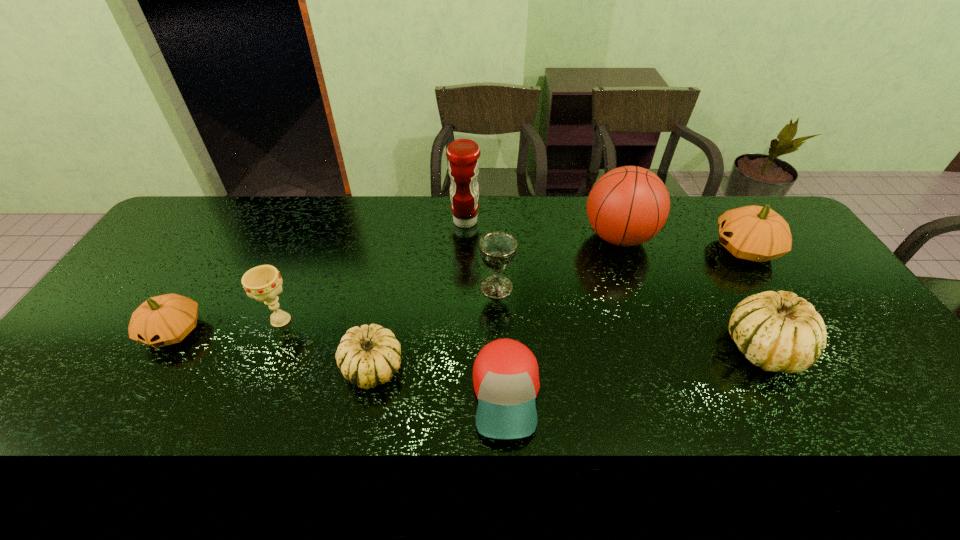
Where is `object that is at the right edge`? The image size is (960, 540). object that is at the right edge is located at coordinates (754, 233).

Where is `object present at the far right corner`? This screenshot has height=540, width=960. object present at the far right corner is located at coordinates (754, 233).

This screenshot has height=540, width=960. What are the coordinates of `vacant area at the far edge` in the screenshot? It's located at (505, 227).

Find the location of a particular element. The width and height of the screenshot is (960, 540). vacant space at the left edge of the desktop is located at coordinates (139, 284).

This screenshot has width=960, height=540. I want to click on vacant region at the right edge of the desktop, so click(x=821, y=303).

At what (x,y) coordinates should I click in order to perform the action: click on free spot between the smaller orange gourd and the third object from right to left. Please return your answer as a coordinate pair (x, y). Looking at the image, I should click on (396, 285).

Find the location of a particular element. Image resolution: width=960 pixels, height=540 pixels. vacant space that is in between the leftmost object and the third object from right to left is located at coordinates (396, 285).

Image resolution: width=960 pixels, height=540 pixels. I want to click on free space between the left white gourd and the leftmost object, so (273, 349).

Where is `free space between the left orange gourd and the left chalice`? The image size is (960, 540). free space between the left orange gourd and the left chalice is located at coordinates (228, 326).

You are a GUI agent. You are given a task and a screenshot of the screen. Output one action in this format:
    pyautogui.click(x=<x>, y=<y>)
    Task: Click on the free spot between the nearer chalice and the sixth nearest object
    This screenshot has width=960, height=540.
    Given the screenshot: What is the action you would take?
    pyautogui.click(x=389, y=303)